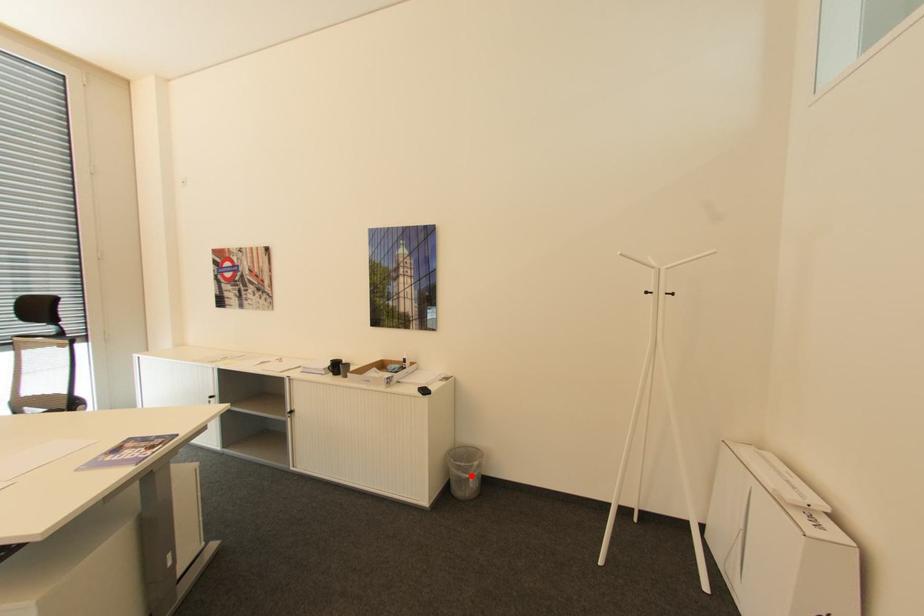
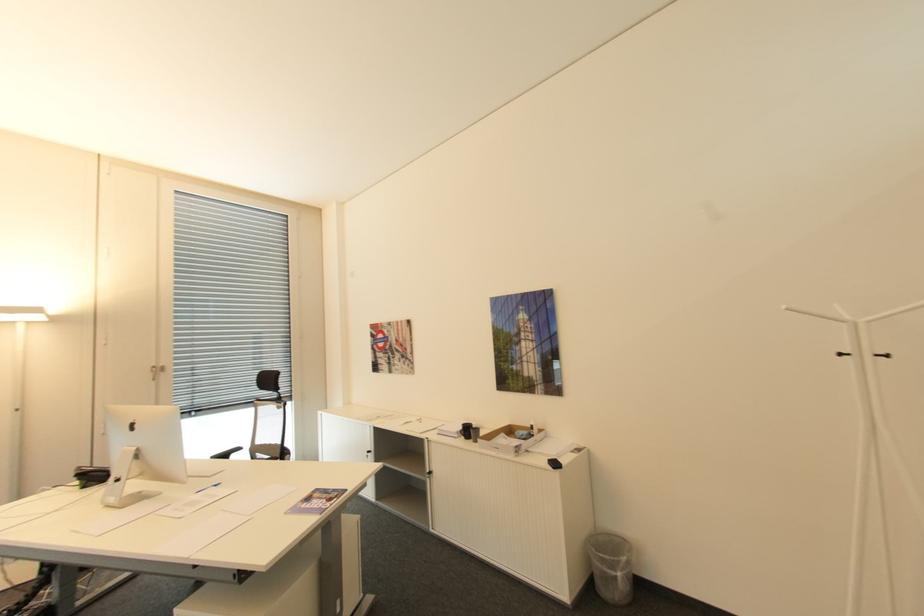
Question: I am providing you with two images of the same scene from different viewpoints. A red point is shown in image1. For the corresponding object point in image2, is it positioned nearer or farther from the camera?

Choices:
 (A) Nearer
 (B) Farther

Answer: (A)